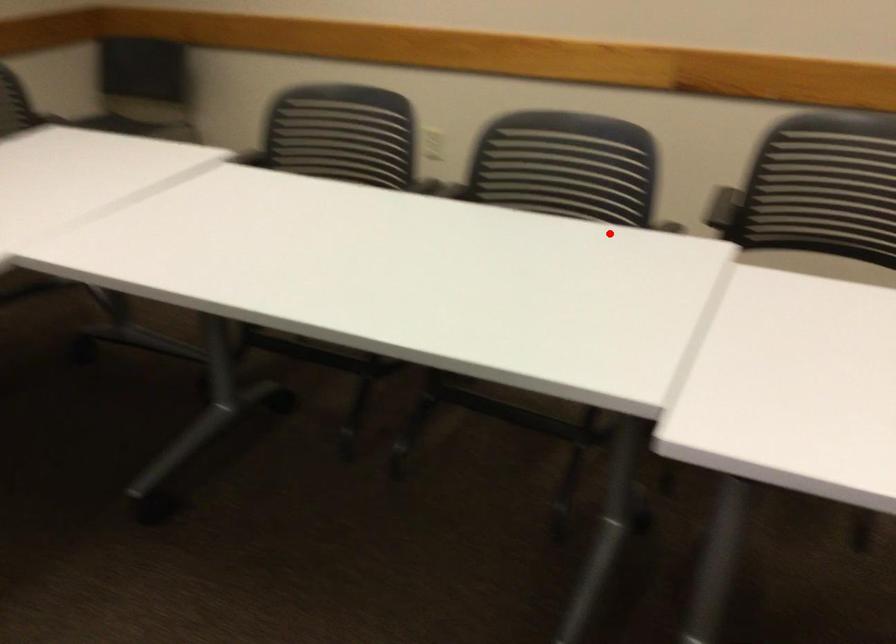
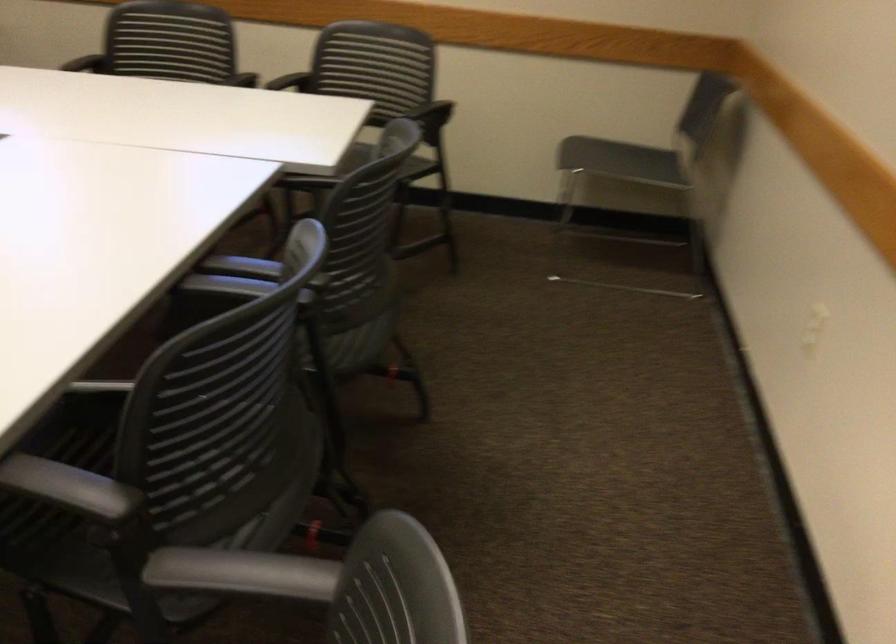
Locate, in the second image, the point that corresponds to the highlighted location in the first image.

(209, 458)